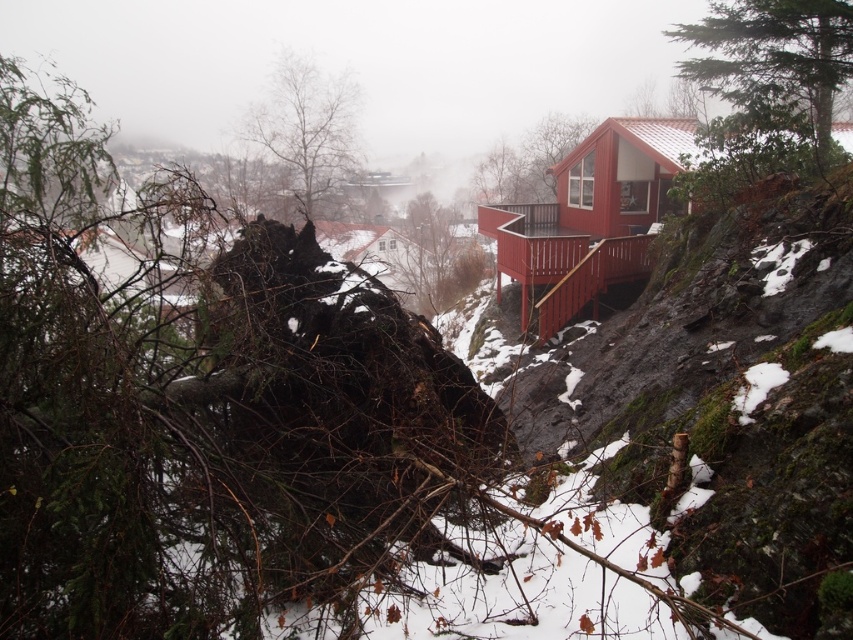
In the scene shown: You are standing at the origin point in the snowy landscape. There are two points marked in the image. Which point is closer to you, point (270, 116) or point (421, 308)?

Point (421, 308) is closer to you because it is in front of point (270, 116).

You are an outdoor adventurer planning to set up a tent between the smooth bark tree at upper center and the white wooden cabin at center. Considering the distance between them, can you estimate if the space is sufficient for a standard tent that requires 20 feet of clear space?

The distance between the smooth bark tree at upper center and the white wooden cabin at center is 18.91 feet, which is slightly less than the required 20 feet for a standard tent. Therefore, the space may be insufficient for the tent.

You are standing in front of the red house and looking towards the snowy slope. Which tree, the green textured tree at upper right or the smooth bark tree at upper center, is positioned more to your right side?

The green textured tree at upper right is positioned more to the right side than the smooth bark tree at upper center.